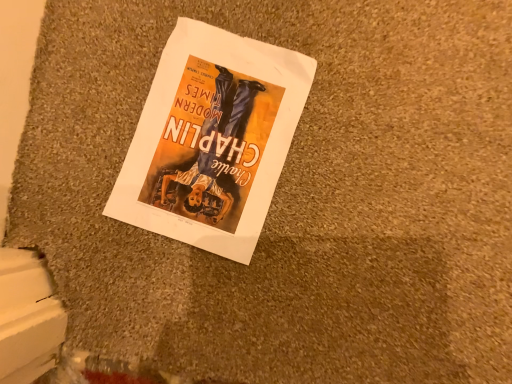
Describe the element at coordinates (212, 139) in the screenshot. This screenshot has height=384, width=512. I see `matte paper poster at center` at that location.

The image size is (512, 384). I want to click on matte paper poster at center, so click(212, 139).

Identify the location of matte paper poster at center. This screenshot has height=384, width=512. (212, 139).